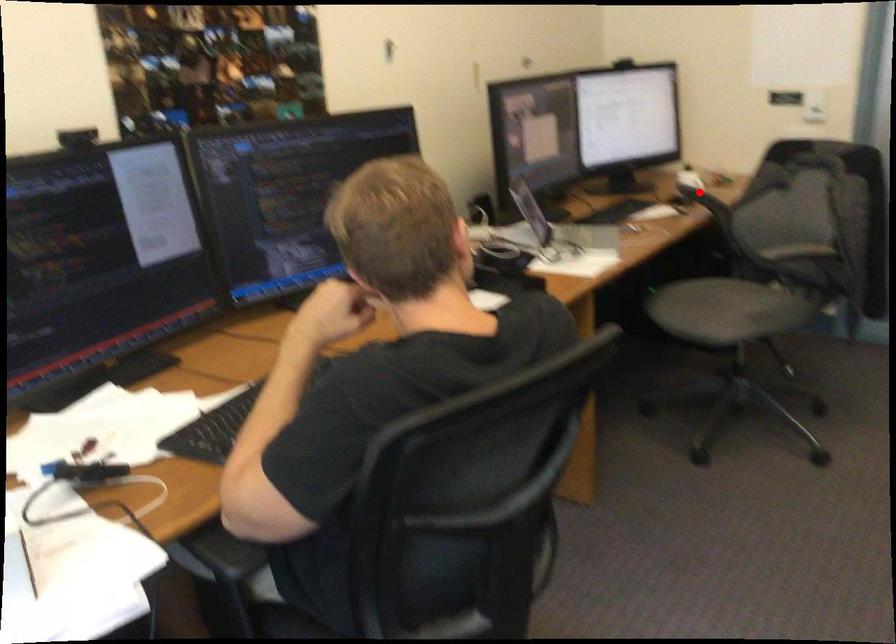
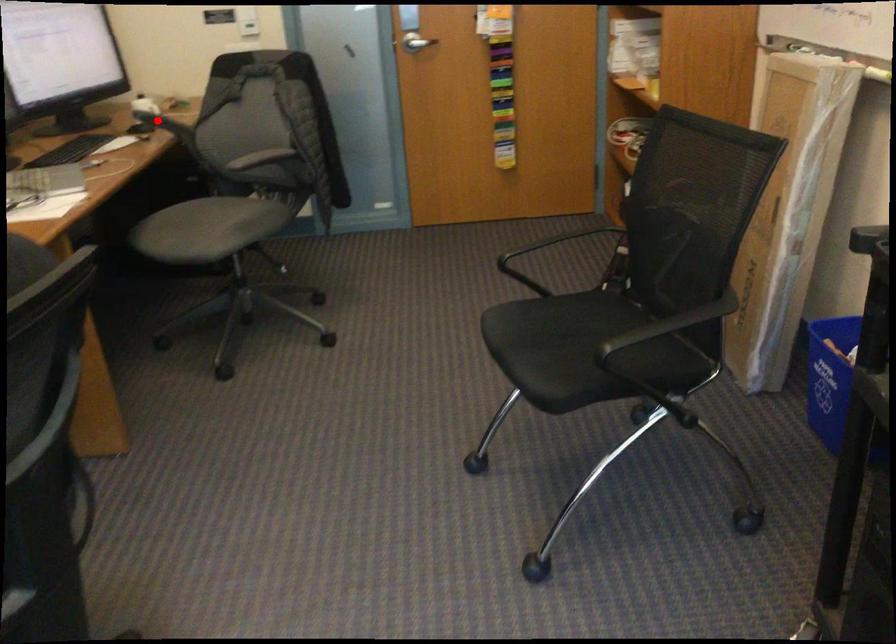
I am providing you with two images of the same scene from different viewpoints. A red point is marked on the first image and another point is marked on the second image. Is the marked point in image1 the same physical position as the marked point in image2?

Yes